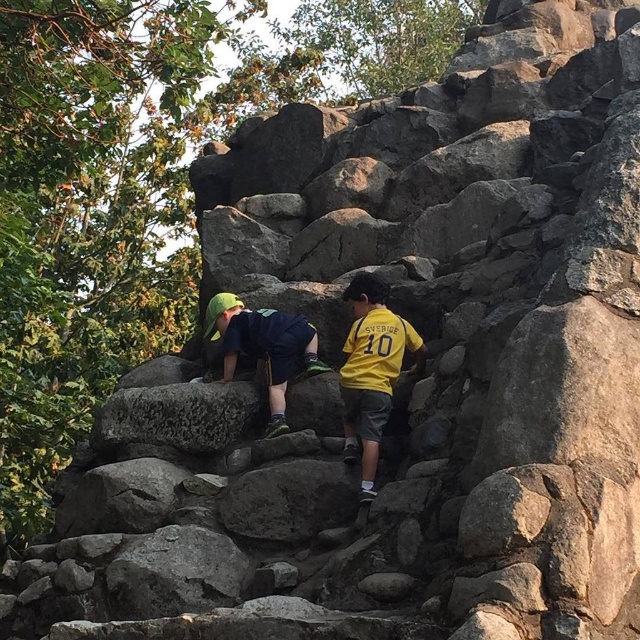
You are a photographer trying to capture both the yellow jersey at center and the green fabric shirt at upper center in the same frame. Based on their positions, which one will appear larger in the photo?

The yellow jersey at center appears larger in the photo because it has a greater height compared to the green fabric shirt at upper center.

You are a parent watching your children play on the rocky structure. You notice the yellow jersey at center and the green fabric shirt at upper center. Which child is higher up the rocks?

The green fabric shirt at upper center is higher up the rocks than the yellow jersey at center.

You are a photographer trying to capture a clear shot of the yellow jersey at center. Based on the scene description, where should you position your camera to ensure the jersey is in the frame?

The yellow jersey at center is located at point [371,371], so positioning the camera at the center of the image would ensure the jersey is in the frame.